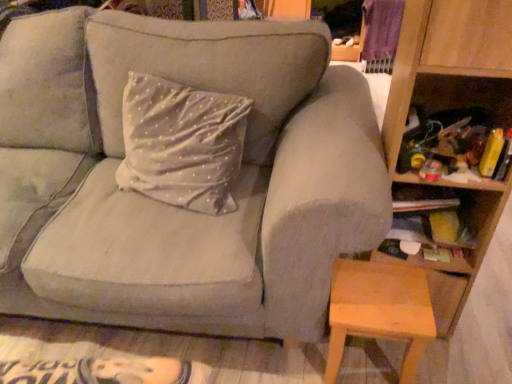
Question: Is wooden stool at lower right at the left side of wooden bookshelf at right?

Choices:
 (A) no
 (B) yes

Answer: (B)

Question: Considering the relative sizes of wooden stool at lower right and wooden bookshelf at right in the image provided, is wooden stool at lower right taller than wooden bookshelf at right?

Choices:
 (A) yes
 (B) no

Answer: (B)

Question: From a real-world perspective, is wooden stool at lower right beneath wooden bookshelf at right?

Choices:
 (A) yes
 (B) no

Answer: (A)

Question: Is wooden stool at lower right beside wooden bookshelf at right?

Choices:
 (A) no
 (B) yes

Answer: (A)

Question: From the image's perspective, does wooden stool at lower right appear higher than wooden bookshelf at right?

Choices:
 (A) no
 (B) yes

Answer: (A)

Question: Considering the relative positions of wooden bookshelf at right and wooden stool at lower right in the image provided, is wooden bookshelf at right to the left or to the right of wooden stool at lower right?

Choices:
 (A) right
 (B) left

Answer: (A)

Question: Is wooden bookshelf at right wider or thinner than wooden stool at lower right?

Choices:
 (A) thin
 (B) wide

Answer: (B)

Question: Does point (466, 258) appear closer or farther from the camera than point (399, 339)?

Choices:
 (A) closer
 (B) farther

Answer: (B)

Question: From a real-world perspective, is wooden bookshelf at right physically located above or below wooden stool at lower right?

Choices:
 (A) below
 (B) above

Answer: (B)

Question: In the image, is suede gray couch at center on the left side or the right side of wooden bookshelf at right?

Choices:
 (A) left
 (B) right

Answer: (A)

Question: Considering their positions, is suede gray couch at center located in front of or behind wooden bookshelf at right?

Choices:
 (A) behind
 (B) front

Answer: (B)

Question: Is suede gray couch at center taller or shorter than wooden bookshelf at right?

Choices:
 (A) tall
 (B) short

Answer: (B)

Question: From the image's perspective, is suede gray couch at center above or below wooden bookshelf at right?

Choices:
 (A) below
 (B) above

Answer: (B)

Question: From a real-world perspective, is wooden stool at lower right positioned above or below suede gray couch at center?

Choices:
 (A) below
 (B) above

Answer: (A)

Question: Is point (340, 349) closer or farther from the camera than point (342, 236)?

Choices:
 (A) closer
 (B) farther

Answer: (B)